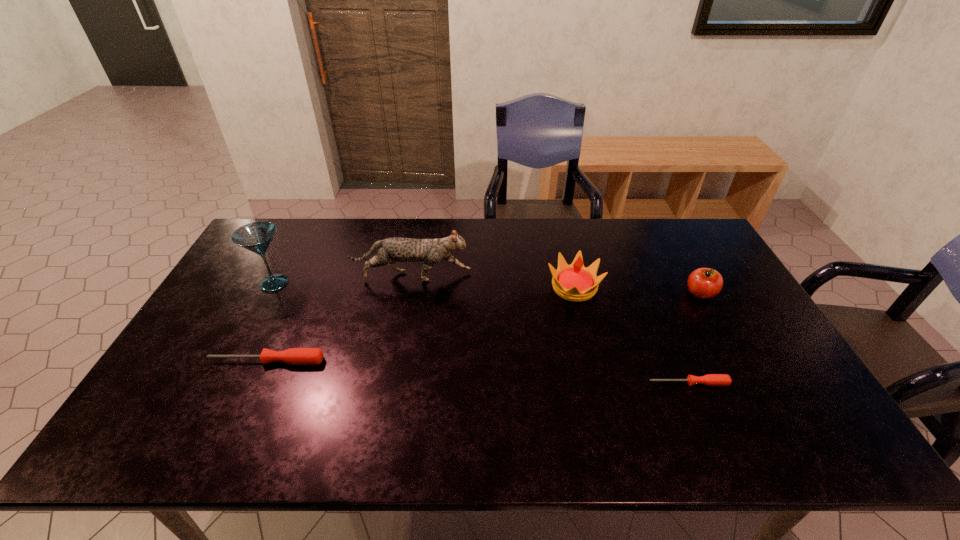
The image size is (960, 540). Find the location of `object that is at the right edge`. object that is at the right edge is located at coordinates (704, 283).

Locate an element on the screen. vacant space at the far edge of the desktop is located at coordinates (552, 237).

At what (x,y) coordinates should I click in order to perform the action: click on free space at the near edge. Please return your answer as a coordinate pair (x, y). This screenshot has height=540, width=960. Looking at the image, I should click on (335, 388).

The image size is (960, 540). Identify the location of free space at the left edge of the desktop. (229, 298).

Image resolution: width=960 pixels, height=540 pixels. In order to click on free space at the right edge in this screenshot , I will do [732, 313].

I want to click on empty space between the right screwdriver and the farther screwdriver, so click(477, 372).

The width and height of the screenshot is (960, 540). I want to click on vacant region between the farther screwdriver and the martini, so coord(270,322).

You are a GUI agent. You are given a task and a screenshot of the screen. Output one action in this format:
    pyautogui.click(x=<x>, y=<y>)
    Task: Click on the free space between the taller screwdriver and the martini
    
    Given the screenshot: What is the action you would take?
    pyautogui.click(x=270, y=322)

You are a GUI agent. You are given a task and a screenshot of the screen. Output one action in this format:
    pyautogui.click(x=<x>, y=<y>)
    Task: Click on the free space that is in between the shortest object and the fourth object from left to right
    
    Given the screenshot: What is the action you would take?
    tap(632, 335)

Where is `vacant space that is in between the martini and the third tallest object`? This screenshot has width=960, height=540. vacant space that is in between the martini and the third tallest object is located at coordinates (424, 285).